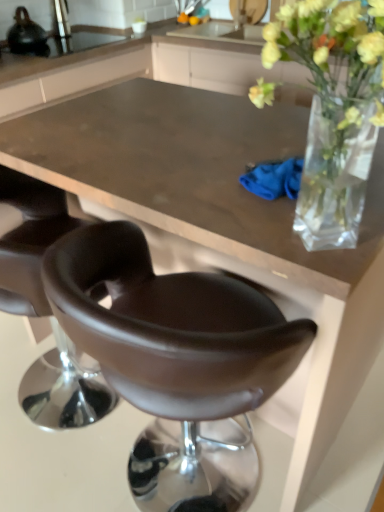
Question: From the image's perspective, is shiny black kettle at upper left on top of brown leather chair at center, which is the second chair from left to right?

Choices:
 (A) no
 (B) yes

Answer: (B)

Question: Is shiny black kettle at upper left at the right side of brown leather chair at center, which is the second chair from left to right?

Choices:
 (A) yes
 (B) no

Answer: (B)

Question: Can you confirm if shiny black kettle at upper left is thinner than brown leather chair at center, which is the second chair from left to right?

Choices:
 (A) no
 (B) yes

Answer: (B)

Question: Is shiny black kettle at upper left aimed at brown leather chair at center, which is the second chair from left to right?

Choices:
 (A) no
 (B) yes

Answer: (A)

Question: Is shiny black kettle at upper left not close to brown leather chair at center, placed as the 1th chair when sorted from right to left?

Choices:
 (A) yes
 (B) no

Answer: (A)

Question: Is shiny black kettle at upper left further to the viewer compared to brown leather chair at center, which is the second chair from left to right?

Choices:
 (A) no
 (B) yes

Answer: (B)

Question: Does leather-like brown chair at lower left, which is the second chair from right to left, have a smaller size compared to brown leather chair at center, placed as the 1th chair when sorted from right to left?

Choices:
 (A) yes
 (B) no

Answer: (B)

Question: Is leather-like brown chair at lower left, the first chair when ordered from left to right, turned away from brown leather chair at center, which is the second chair from left to right?

Choices:
 (A) yes
 (B) no

Answer: (B)

Question: Does leather-like brown chair at lower left, which is the second chair from right to left, come in front of brown leather chair at center, placed as the 1th chair when sorted from right to left?

Choices:
 (A) no
 (B) yes

Answer: (A)

Question: Considering the relative sizes of leather-like brown chair at lower left, the first chair when ordered from left to right, and brown leather chair at center, which is the second chair from left to right, in the image provided, is leather-like brown chair at lower left, the first chair when ordered from left to right, taller than brown leather chair at center, which is the second chair from left to right,?

Choices:
 (A) yes
 (B) no

Answer: (B)

Question: Is brown leather chair at center, which is the second chair from left to right, surrounded by leather-like brown chair at lower left, the first chair when ordered from left to right?

Choices:
 (A) yes
 (B) no

Answer: (B)

Question: From the image's perspective, does leather-like brown chair at lower left, which is the second chair from right to left, appear higher than brown leather chair at center, placed as the 1th chair when sorted from right to left?

Choices:
 (A) no
 (B) yes

Answer: (B)

Question: Is translucent glass vase at upper right further to the viewer compared to leather-like brown chair at lower left, which is the second chair from right to left?

Choices:
 (A) no
 (B) yes

Answer: (A)